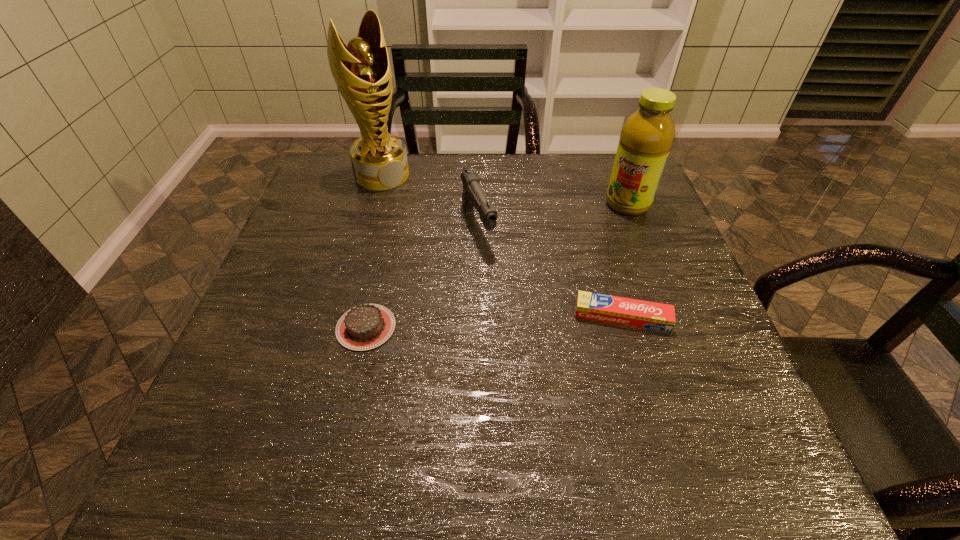
Identify the location of object that is the fourth closest to the toothpaste. (362, 72).

Locate which object is the second closest to the third tallest object. Please provide its 2D coordinates. Your answer should be formatted as a tuple, i.e. [(x, y)], where the tuple contains the x and y coordinates of a point satisfying the conditions above.

[(367, 326)]

Find the location of `free point that satisfies the following two spatial constraints: 1. on the back side of the fruit juice; 2. on the left side of the gun`. free point that satisfies the following two spatial constraints: 1. on the back side of the fruit juice; 2. on the left side of the gun is located at coordinates (478, 204).